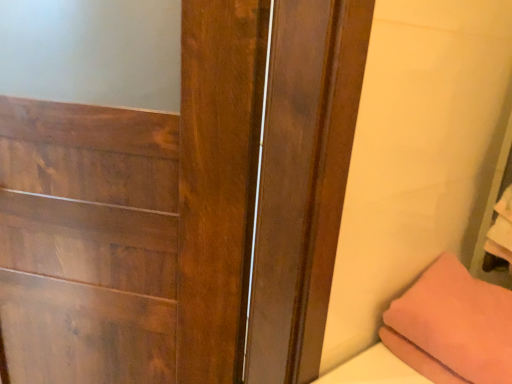
Question: Can we say wooden door at center lies outside pink fabric pillow at lower right?

Choices:
 (A) no
 (B) yes

Answer: (B)

Question: From the image's perspective, is wooden door at center under pink fabric pillow at lower right?

Choices:
 (A) no
 (B) yes

Answer: (A)

Question: Is the position of wooden door at center less distant than that of pink fabric pillow at lower right?

Choices:
 (A) yes
 (B) no

Answer: (A)

Question: Does wooden door at center appear on the left side of pink fabric pillow at lower right?

Choices:
 (A) no
 (B) yes

Answer: (B)

Question: Is the depth of wooden door at center greater than that of pink fabric pillow at lower right?

Choices:
 (A) yes
 (B) no

Answer: (B)

Question: Does wooden door at center have a greater width compared to pink fabric pillow at lower right?

Choices:
 (A) no
 (B) yes

Answer: (A)

Question: Is pink fabric pillow at lower right far away from wooden door at center?

Choices:
 (A) yes
 (B) no

Answer: (B)

Question: Is pink fabric pillow at lower right oriented towards wooden door at center?

Choices:
 (A) yes
 (B) no

Answer: (B)

Question: From the image's perspective, does pink fabric pillow at lower right appear lower than wooden door at center?

Choices:
 (A) yes
 (B) no

Answer: (A)

Question: Can you confirm if pink fabric pillow at lower right is wider than wooden door at center?

Choices:
 (A) no
 (B) yes

Answer: (B)

Question: Is pink fabric pillow at lower right oriented away from wooden door at center?

Choices:
 (A) no
 (B) yes

Answer: (A)

Question: Can you confirm if pink fabric pillow at lower right is taller than wooden door at center?

Choices:
 (A) yes
 (B) no

Answer: (B)

Question: In the image, is wooden door at center positioned in front of or behind pink fabric pillow at lower right?

Choices:
 (A) behind
 (B) front

Answer: (B)